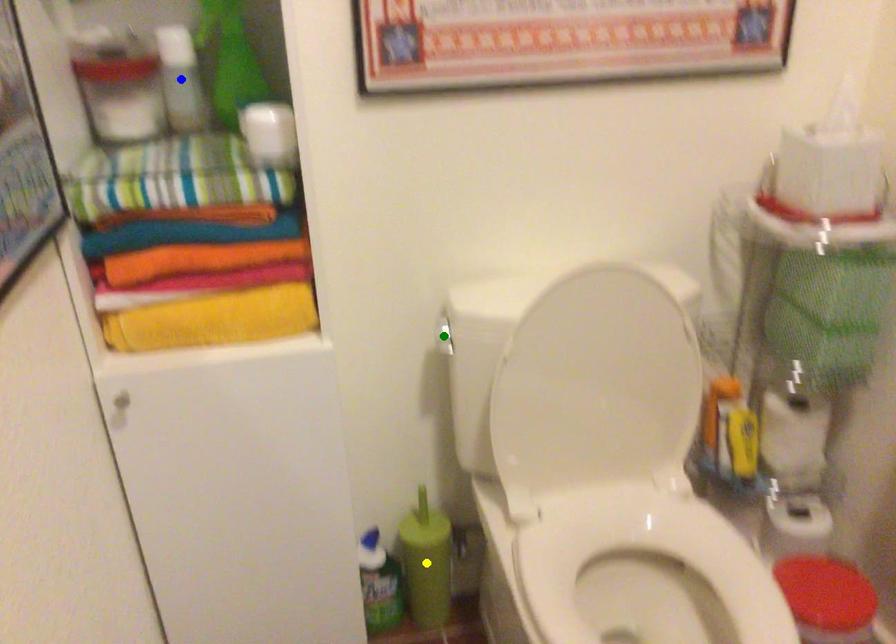
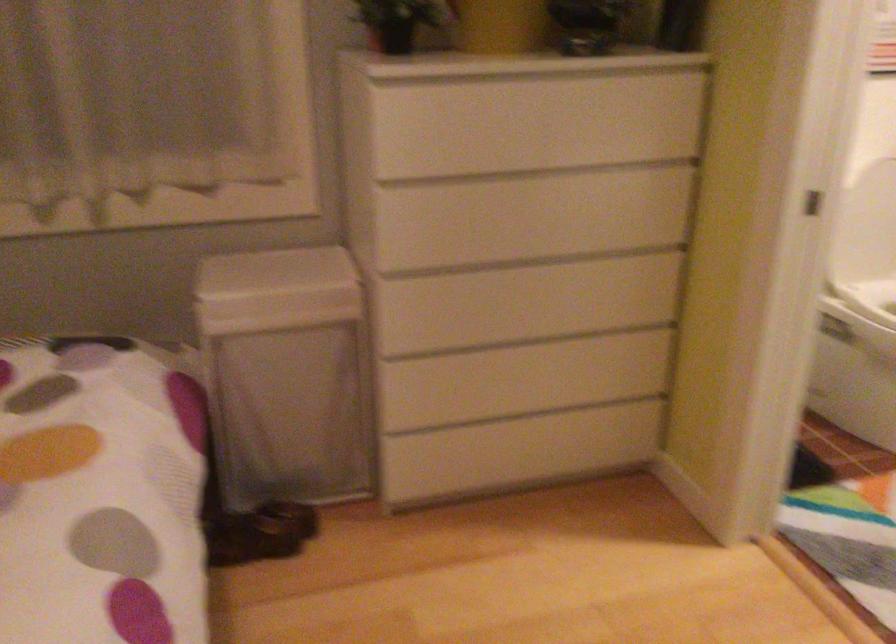
I am providing you with two images of the same scene from different viewpoints. Three points are marked in image1. Which point corresponds to a part or object that is occluded in image2?In image1, three points are marked. Which of them correspond to a part or object that is occluded in image2?Among the three points shown in image1, which one corresponds to a part or object that is no longer visible due to occlusion in image2?

green point, blue point, yellow point